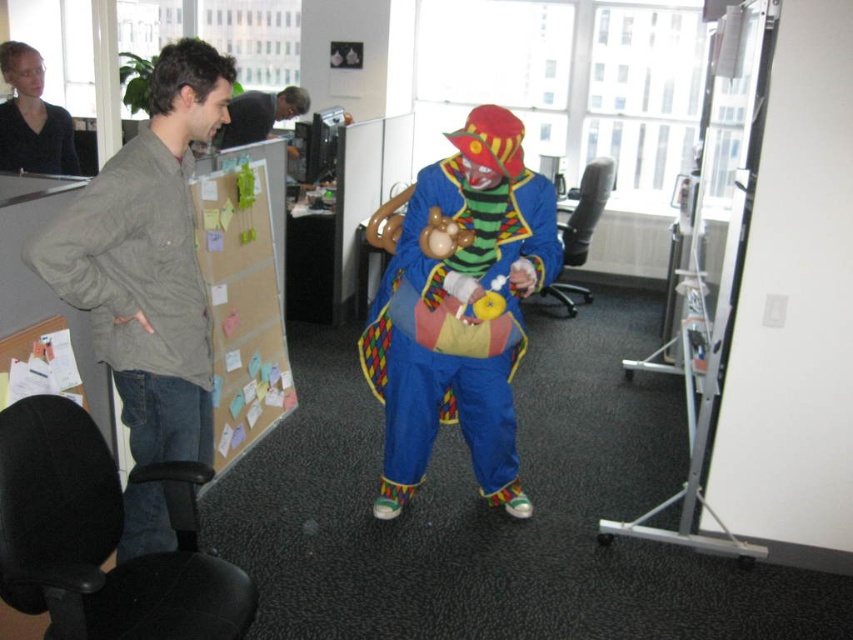
Can you confirm if matte blue clown costume at center is wider than matte gray jacket at left?

Yes, matte blue clown costume at center is wider than matte gray jacket at left.

Is matte blue clown costume at center above matte gray jacket at left?

No, matte blue clown costume at center is not above matte gray jacket at left.

Between point (494, 241) and point (171, 348), which one is positioned in front?

Positioned in front is point (171, 348).

At what (x,y) coordinates should I click in order to perform the action: click on matte blue clown costume at center. Please return your answer as a coordinate pair (x, y). Looking at the image, I should click on (457, 326).

Which of these two, matte blue clown costume at center or matte black shirt at upper left, stands shorter?

matte black shirt at upper left

Who is positioned more to the right, matte blue clown costume at center or matte black shirt at upper left?

Positioned to the right is matte blue clown costume at center.

Does point (415, 328) lie in front of point (19, 134)?

Yes.

Identify the location of matte blue clown costume at center. (457, 326).

Between matte blue clown costume at center and smooth black hair at upper center, which one is positioned higher?

smooth black hair at upper center is higher up.

How far apart are matte blue clown costume at center and smooth black hair at upper center?

matte blue clown costume at center is 2.40 meters from smooth black hair at upper center.

This screenshot has width=853, height=640. What do you see at coordinates (457, 326) in the screenshot?
I see `matte blue clown costume at center` at bounding box center [457, 326].

The width and height of the screenshot is (853, 640). Find the location of `matte blue clown costume at center`. matte blue clown costume at center is located at coordinates (457, 326).